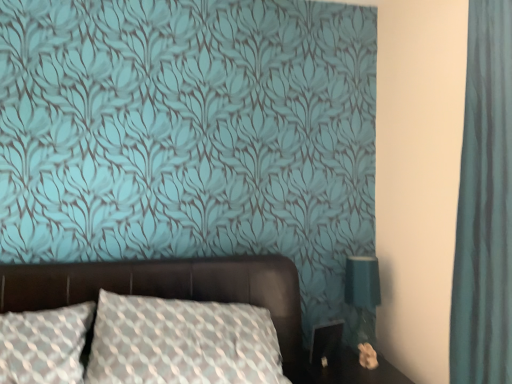
The image size is (512, 384). Find the location of `teal fabric lampshade at right`. teal fabric lampshade at right is located at coordinates (362, 295).

What is the approximate height of leather bed at center?

leather bed at center is 27.93 inches in height.

The image size is (512, 384). Describe the element at coordinates (485, 205) in the screenshot. I see `teal fabric curtain at right` at that location.

Locate an element on the screen. The height and width of the screenshot is (384, 512). teal fabric lampshade at right is located at coordinates (362, 295).

From the picture: Would you say teal fabric curtain at right is to the left or to the right of leather bed at center in the picture?

Clearly, teal fabric curtain at right is on the right of leather bed at center in the image.

Is leather bed at center at the back of teal fabric curtain at right?

teal fabric curtain at right does not have its back to leather bed at center.

Between teal fabric curtain at right and leather bed at center, which one has less height?

With less height is leather bed at center.

Considering the sizes of objects teal fabric curtain at right and leather bed at center in the image provided, who is smaller, teal fabric curtain at right or leather bed at center?

teal fabric curtain at right is smaller.

Based on the photo, between leather bed at center and black glossy table at lower right, which one has less height?

black glossy table at lower right is shorter.

Consider the image. Would you consider leather bed at center to be distant from black glossy table at lower right?

They are positioned close to each other.

In the scene shown: Between leather bed at center and black glossy table at lower right, which one appears on the left side from the viewer's perspective?

From the viewer's perspective, leather bed at center appears more on the left side.

Would you say black glossy table at lower right is inside or outside leather bed at center?

black glossy table at lower right is spatially situated outside leather bed at center.

Locate an element on the screen. The width and height of the screenshot is (512, 384). table behind the leather bed at center is located at coordinates (347, 371).

Consider the image. Looking at their sizes, would you say black glossy table at lower right is wider or thinner than leather bed at center?

black glossy table at lower right is thinner than leather bed at center.

Is teal fabric lampshade at right turned away from teal fabric curtain at right?

teal fabric lampshade at right is not turned away from teal fabric curtain at right.

Where is `table lamp lying on the left of teal fabric curtain at right`? The width and height of the screenshot is (512, 384). table lamp lying on the left of teal fabric curtain at right is located at coordinates (362, 295).

Is point (371, 324) positioned before point (501, 26)?

No, (371, 324) is further to viewer.

Considering the positions of objects leather bed at center and teal fabric lampshade at right in the image provided, who is in front, leather bed at center or teal fabric lampshade at right?

leather bed at center.

In terms of size, does leather bed at center appear bigger or smaller than teal fabric lampshade at right?

leather bed at center is bigger than teal fabric lampshade at right.

Is leather bed at center looking in the opposite direction of teal fabric lampshade at right?

No.

Where is `bed above the teal fabric lampshade at right (from a real-world perspective)`? bed above the teal fabric lampshade at right (from a real-world perspective) is located at coordinates (167, 287).

From the image's perspective, does teal fabric curtain at right appear lower than black glossy table at lower right?

No, from the image's perspective, teal fabric curtain at right is not beneath black glossy table at lower right.

Based on the photo, how different are the orientations of teal fabric curtain at right and black glossy table at lower right in degrees?

There is a 92.1-degree angle between the facing directions of teal fabric curtain at right and black glossy table at lower right.

Is there a large distance between teal fabric curtain at right and black glossy table at lower right?

Actually, teal fabric curtain at right and black glossy table at lower right are a little close together.

Is teal fabric lampshade at right aimed at leather bed at center?

No, teal fabric lampshade at right is not turned towards leather bed at center.

Locate an element on the screen. table lamp below the leather bed at center (from a real-world perspective) is located at coordinates (362, 295).

Is leather bed at center inside teal fabric lampshade at right?

No, leather bed at center is not surrounded by teal fabric lampshade at right.

Which of these two, teal fabric lampshade at right or leather bed at center, stands shorter?

Standing shorter between the two is teal fabric lampshade at right.

Locate an element on the screen. This screenshot has width=512, height=384. bed on the left of teal fabric curtain at right is located at coordinates (167, 287).

Identify the location of table located on the right of leather bed at center. (347, 371).

Considering their positions, is leather bed at center positioned closer to teal fabric lampshade at right than teal fabric curtain at right?

Among the two, leather bed at center is located nearer to teal fabric lampshade at right.

Based on their spatial positions, is teal fabric curtain at right or black glossy table at lower right further from leather bed at center?

teal fabric curtain at right is positioned further to the anchor leather bed at center.

Considering their positions, is black glossy table at lower right positioned further to leather bed at center than teal fabric curtain at right?

Based on the image, teal fabric curtain at right appears to be further to leather bed at center.

When comparing their distances from leather bed at center, does teal fabric lampshade at right or black glossy table at lower right seem closer?

The object closer to leather bed at center is black glossy table at lower right.

When comparing their distances from black glossy table at lower right, does teal fabric lampshade at right or leather bed at center seem further?

leather bed at center is further to black glossy table at lower right.

When comparing their distances from leather bed at center, does black glossy table at lower right or teal fabric lampshade at right seem closer?

Among the two, black glossy table at lower right is located nearer to leather bed at center.

From the image, which object appears to be nearer to teal fabric curtain at right, teal fabric lampshade at right or black glossy table at lower right?

Among the two, teal fabric lampshade at right is located nearer to teal fabric curtain at right.

Based on their spatial positions, is black glossy table at lower right or teal fabric curtain at right closer to teal fabric lampshade at right?

Based on the image, black glossy table at lower right appears to be nearer to teal fabric lampshade at right.

This screenshot has height=384, width=512. In order to click on table lamp between leather bed at center and teal fabric curtain at right in this screenshot , I will do `click(362, 295)`.

Where is `table between leather bed at center and teal fabric lampshade at right`? The image size is (512, 384). table between leather bed at center and teal fabric lampshade at right is located at coordinates (347, 371).

The height and width of the screenshot is (384, 512). In order to click on table positioned between teal fabric curtain at right and teal fabric lampshade at right from near to far in this screenshot , I will do `click(347, 371)`.

The image size is (512, 384). Find the location of `table located between leather bed at center and teal fabric curtain at right in the left-right direction`. table located between leather bed at center and teal fabric curtain at right in the left-right direction is located at coordinates (347, 371).